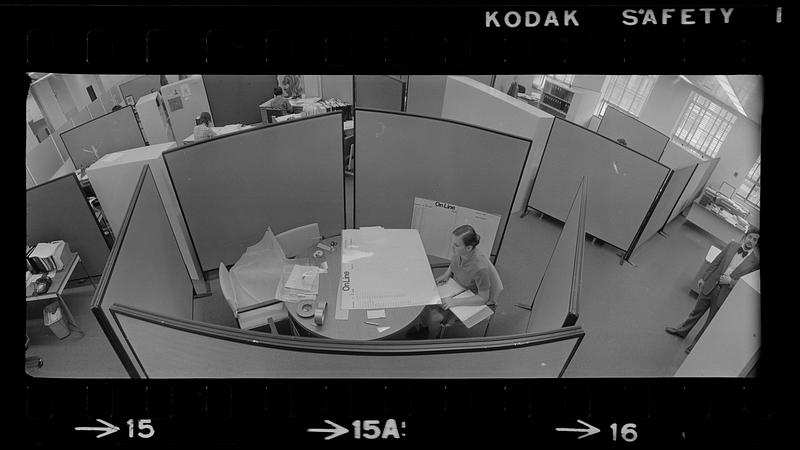
Find the location of a particular element. This screenshot has width=800, height=450. table is located at coordinates (65, 257).